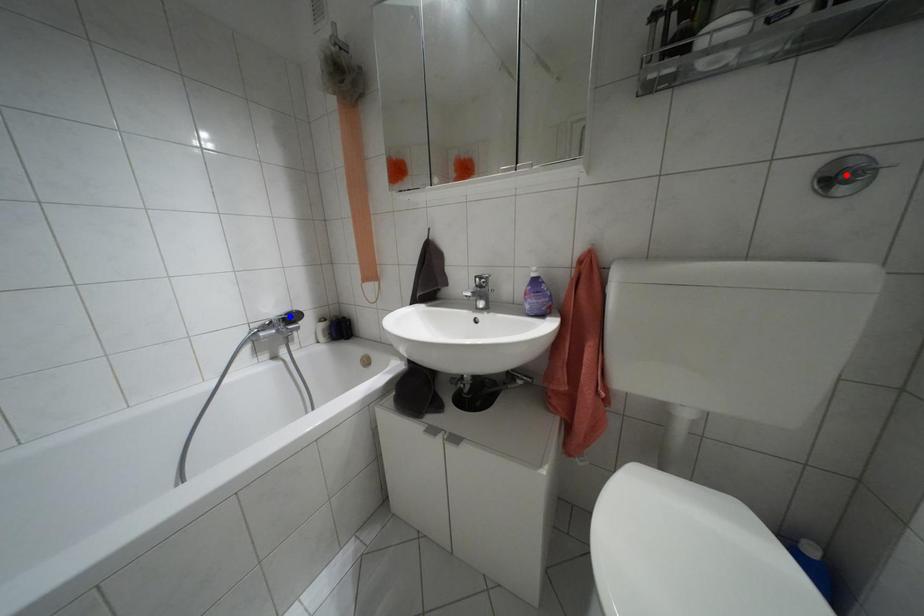
Question: Which of the two points in the image is closer to the camera?

Choices:
 (A) Blue point is closer.
 (B) Red point is closer.

Answer: (B)